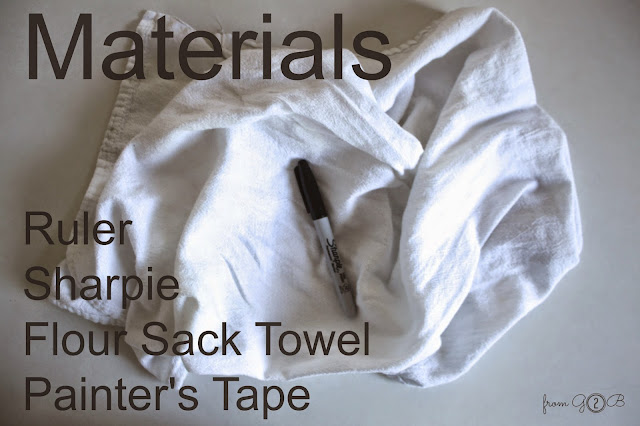
This screenshot has width=640, height=426. What are the coordinates of `towel` in the screenshot? It's located at (536, 247), (479, 139).